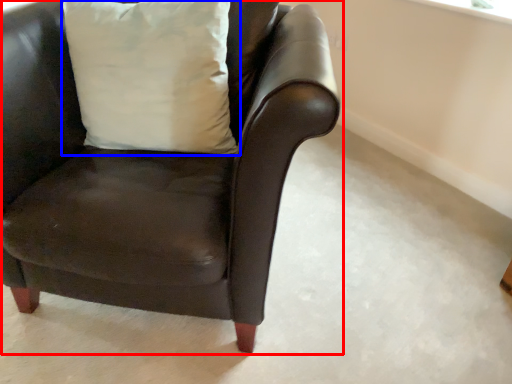
Question: Which object appears closest to the camera in this image, chair (highlighted by a red box) or pillow (highlighted by a blue box)?

Choices:
 (A) chair
 (B) pillow

Answer: (A)